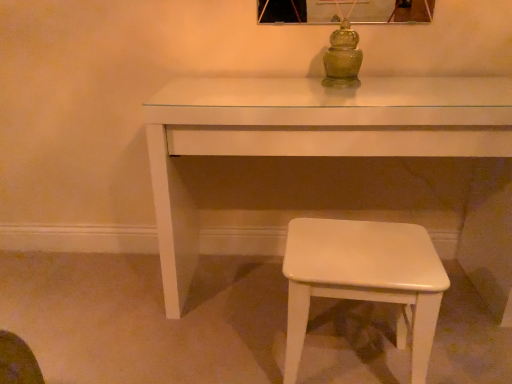
Question: Considering the relative sizes of white glossy stool at lower right and green glass jar at center in the image provided, is white glossy stool at lower right bigger than green glass jar at center?

Choices:
 (A) no
 (B) yes

Answer: (B)

Question: Does white glossy stool at lower right appear on the right side of green glass jar at center?

Choices:
 (A) yes
 (B) no

Answer: (A)

Question: Considering the relative sizes of white glossy stool at lower right and green glass jar at center in the image provided, is white glossy stool at lower right taller than green glass jar at center?

Choices:
 (A) no
 (B) yes

Answer: (B)

Question: Is white glossy stool at lower right at the left side of green glass jar at center?

Choices:
 (A) yes
 (B) no

Answer: (B)

Question: Considering the relative sizes of white glossy stool at lower right and green glass jar at center in the image provided, is white glossy stool at lower right thinner than green glass jar at center?

Choices:
 (A) no
 (B) yes

Answer: (A)

Question: Is white glossy stool at lower right far from green glass jar at center?

Choices:
 (A) yes
 (B) no

Answer: (B)

Question: Is white glossy table at center turned away from white glossy stool at lower right?

Choices:
 (A) yes
 (B) no

Answer: (A)

Question: Is white glossy table at center at the left side of white glossy stool at lower right?

Choices:
 (A) yes
 (B) no

Answer: (A)

Question: Does white glossy table at center appear on the right side of white glossy stool at lower right?

Choices:
 (A) no
 (B) yes

Answer: (A)

Question: Is white glossy table at center in front of white glossy stool at lower right?

Choices:
 (A) no
 (B) yes

Answer: (A)

Question: Is white glossy table at center thinner than white glossy stool at lower right?

Choices:
 (A) no
 (B) yes

Answer: (A)

Question: Considering the relative sizes of white glossy table at center and white glossy stool at lower right in the image provided, is white glossy table at center bigger than white glossy stool at lower right?

Choices:
 (A) yes
 (B) no

Answer: (A)

Question: From a real-world perspective, is green glass jar at center below white glossy table at center?

Choices:
 (A) no
 (B) yes

Answer: (A)